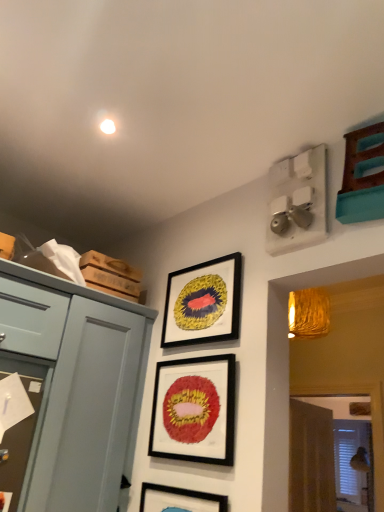
What do you see at coordinates (203, 303) in the screenshot?
I see `matte black picture frame at upper center, the third picture frame in the bottom-to-top sequence` at bounding box center [203, 303].

Locate an element on the screen. matte black picture frame at upper center, which appears as the 1th picture frame when viewed from the top is located at coordinates (203, 303).

From a real-world perspective, between matte blue cabinet at left and brown textured curtain at lower right, who is vertically higher?

matte blue cabinet at left is physically above.

Find the location of `cabinetry above the brown textured curtain at lower right (from the image's perspective)`. cabinetry above the brown textured curtain at lower right (from the image's perspective) is located at coordinates (76, 385).

How different are the orientations of matte blue cabinet at left and brown textured curtain at lower right in degrees?

The facing directions of matte blue cabinet at left and brown textured curtain at lower right are 6.17 degrees apart.

How much distance is there between matte blue cabinet at left and brown textured curtain at lower right?

matte blue cabinet at left is 7.40 feet from brown textured curtain at lower right.

From the image's perspective, which one is positioned lower, matte black picture frame at center, placed as the 1th picture frame when sorted from bottom to top, or matte black picture frame at center, placed as the 2th picture frame when sorted from bottom to top?

matte black picture frame at center, placed as the 1th picture frame when sorted from bottom to top, from the image's perspective.

Measure the distance between matte black picture frame at center, which ranks as the 3th picture frame in top-to-bottom order, and matte black picture frame at center, placed as the 2th picture frame when sorted from bottom to top.

matte black picture frame at center, which ranks as the 3th picture frame in top-to-bottom order, is 25.39 centimeters away from matte black picture frame at center, placed as the 2th picture frame when sorted from bottom to top.

Are matte black picture frame at center, placed as the 1th picture frame when sorted from bottom to top, and matte black picture frame at center, placed as the 2th picture frame when sorted from bottom to top, located far from each other?

They are positioned close to each other.

Is matte black picture frame at center, placed as the 1th picture frame when sorted from bottom to top, turned away from matte black picture frame at center, which is the 2th picture frame in top-to-bottom order?

That's not correct — matte black picture frame at center, placed as the 1th picture frame when sorted from bottom to top, is not looking away from matte black picture frame at center, which is the 2th picture frame in top-to-bottom order.

Looking at the image, does matte black picture frame at upper center, the third picture frame in the bottom-to-top sequence, seem bigger or smaller compared to brown textured curtain at lower right?

In the image, matte black picture frame at upper center, the third picture frame in the bottom-to-top sequence, appears to be smaller than brown textured curtain at lower right.

From a real-world perspective, between matte black picture frame at upper center, the third picture frame in the bottom-to-top sequence, and brown textured curtain at lower right, who is vertically lower?

brown textured curtain at lower right is physically lower.

Does point (210, 281) come in front of point (328, 481)?

That is True.

Is matte black picture frame at upper center, which appears as the 1th picture frame when viewed from the top, to the left of brown textured curtain at lower right from the viewer's perspective?

Correct, you'll find matte black picture frame at upper center, which appears as the 1th picture frame when viewed from the top, to the left of brown textured curtain at lower right.

Looking at this image, which of these two, brown textured curtain at lower right or matte black picture frame at center, placed as the 2th picture frame when sorted from bottom to top, is wider?

brown textured curtain at lower right.

From a real-world perspective, is brown textured curtain at lower right positioned above or below matte black picture frame at center, placed as the 2th picture frame when sorted from bottom to top?

From a real-world perspective, brown textured curtain at lower right is physically below matte black picture frame at center, placed as the 2th picture frame when sorted from bottom to top.

Does brown textured curtain at lower right touch matte black picture frame at center, placed as the 2th picture frame when sorted from bottom to top?

They are not placed beside each other.

Consider the image. Between brown textured curtain at lower right and matte black picture frame at center, which is the 2th picture frame in top-to-bottom order, which one is positioned in front?

Positioned in front is matte black picture frame at center, which is the 2th picture frame in top-to-bottom order.

Is matte blue cabinet at left next to matte blue drawer at left and touching it?

No, matte blue cabinet at left is not next to matte blue drawer at left.

Considering the sizes of objects matte blue cabinet at left and matte blue drawer at left in the image provided, who is bigger, matte blue cabinet at left or matte blue drawer at left?

matte blue cabinet at left.

From a real-world perspective, which object rests below the other?

From a 3D spatial view, matte blue cabinet at left is below.

Based on the photo, how distant is matte blue cabinet at left from matte blue drawer at left?

The distance of matte blue cabinet at left from matte blue drawer at left is 6.52 inches.

Can you see matte black picture frame at upper center, which appears as the 1th picture frame when viewed from the top, touching matte blue drawer at left?

There is a gap between matte black picture frame at upper center, which appears as the 1th picture frame when viewed from the top, and matte blue drawer at left.

Who is more distant, matte black picture frame at upper center, the third picture frame in the bottom-to-top sequence, or matte blue drawer at left?

matte black picture frame at upper center, the third picture frame in the bottom-to-top sequence.

From the image's perspective, is matte black picture frame at upper center, the third picture frame in the bottom-to-top sequence, located above matte blue drawer at left?

Yes, from the image's perspective, matte black picture frame at upper center, the third picture frame in the bottom-to-top sequence, is over matte blue drawer at left.

Can you confirm if matte black picture frame at upper center, which appears as the 1th picture frame when viewed from the top, is positioned to the left of matte blue drawer at left?

No, matte black picture frame at upper center, which appears as the 1th picture frame when viewed from the top, is not to the left of matte blue drawer at left.

Is matte black picture frame at center, placed as the 2th picture frame when sorted from bottom to top, positioned with its back to brown textured curtain at lower right?

Yes, brown textured curtain at lower right is at the back of matte black picture frame at center, placed as the 2th picture frame when sorted from bottom to top.

In terms of height, does matte black picture frame at center, which is the 2th picture frame in top-to-bottom order, look taller or shorter compared to brown textured curtain at lower right?

Considering their sizes, matte black picture frame at center, which is the 2th picture frame in top-to-bottom order, has less height than brown textured curtain at lower right.

Is matte black picture frame at center, placed as the 2th picture frame when sorted from bottom to top, beside brown textured curtain at lower right?

matte black picture frame at center, placed as the 2th picture frame when sorted from bottom to top, and brown textured curtain at lower right are not in contact.

Does point (199, 361) come in front of point (327, 479)?

Yes.

The image size is (384, 512). In order to click on cabinetry on the left of brown textured curtain at lower right in this screenshot , I will do `click(76, 385)`.

The image size is (384, 512). In order to click on the 1st picture frame behind the matte black picture frame at center, which ranks as the 3th picture frame in top-to-bottom order, counting from the anchor's position in this screenshot , I will do `click(194, 410)`.

Based on their spatial positions, is matte blue cabinet at left or matte black picture frame at center, which ranks as the 3th picture frame in top-to-bottom order, further from matte blue drawer at left?

matte black picture frame at center, which ranks as the 3th picture frame in top-to-bottom order, is further to matte blue drawer at left.

Looking at the image, which one is located closer to matte black picture frame at center, which ranks as the 3th picture frame in top-to-bottom order, matte blue drawer at left or matte black picture frame at center, placed as the 2th picture frame when sorted from bottom to top?

Based on the image, matte black picture frame at center, placed as the 2th picture frame when sorted from bottom to top, appears to be nearer to matte black picture frame at center, which ranks as the 3th picture frame in top-to-bottom order.

Based on their spatial positions, is matte blue cabinet at left or matte black picture frame at center, which is the 2th picture frame in top-to-bottom order, closer to brown textured curtain at lower right?

matte black picture frame at center, which is the 2th picture frame in top-to-bottom order.

Consider the image. Considering their positions, is matte black picture frame at upper center, which appears as the 1th picture frame when viewed from the top, positioned further to matte black picture frame at center, placed as the 1th picture frame when sorted from bottom to top, than matte black picture frame at center, placed as the 2th picture frame when sorted from bottom to top?

Among the two, matte black picture frame at upper center, which appears as the 1th picture frame when viewed from the top, is located further to matte black picture frame at center, placed as the 1th picture frame when sorted from bottom to top.

Which object lies further to the anchor point matte black picture frame at upper center, which appears as the 1th picture frame when viewed from the top, matte blue cabinet at left or matte blue drawer at left?

Among the two, matte blue drawer at left is located further to matte black picture frame at upper center, which appears as the 1th picture frame when viewed from the top.

When comparing their distances from matte black picture frame at upper center, which appears as the 1th picture frame when viewed from the top, does brown textured curtain at lower right or matte black picture frame at center, which ranks as the 3th picture frame in top-to-bottom order, seem closer?

matte black picture frame at center, which ranks as the 3th picture frame in top-to-bottom order, is positioned closer to the anchor matte black picture frame at upper center, which appears as the 1th picture frame when viewed from the top.

When comparing their distances from matte blue drawer at left, does matte blue cabinet at left or matte black picture frame at center, which is the 2th picture frame in top-to-bottom order, seem closer?

matte blue cabinet at left lies closer to matte blue drawer at left than the other object.

Based on their spatial positions, is matte blue drawer at left or matte black picture frame at center, placed as the 2th picture frame when sorted from bottom to top, closer to matte black picture frame at upper center, the third picture frame in the bottom-to-top sequence?

matte black picture frame at center, placed as the 2th picture frame when sorted from bottom to top, is positioned closer to the anchor matte black picture frame at upper center, the third picture frame in the bottom-to-top sequence.

At what (x,y) coordinates should I click in order to perform the action: click on picture frame between matte blue drawer at left and matte black picture frame at center, which is the 2th picture frame in top-to-bottom order, in the horizontal direction. Please return your answer as a coordinate pair (x, y). The height and width of the screenshot is (512, 384). Looking at the image, I should click on (179, 500).

Locate an element on the screen. Image resolution: width=384 pixels, height=512 pixels. drawer between matte black picture frame at center, placed as the 2th picture frame when sorted from bottom to top, and brown textured curtain at lower right from front to back is located at coordinates (31, 319).

Find the location of a particular element. This screenshot has height=512, width=384. picture frame situated between matte blue cabinet at left and matte black picture frame at center, placed as the 2th picture frame when sorted from bottom to top, from left to right is located at coordinates (179, 500).

The width and height of the screenshot is (384, 512). In order to click on picture frame positioned between matte black picture frame at center, which is the 2th picture frame in top-to-bottom order, and brown textured curtain at lower right from near to far in this screenshot , I will do point(203,303).